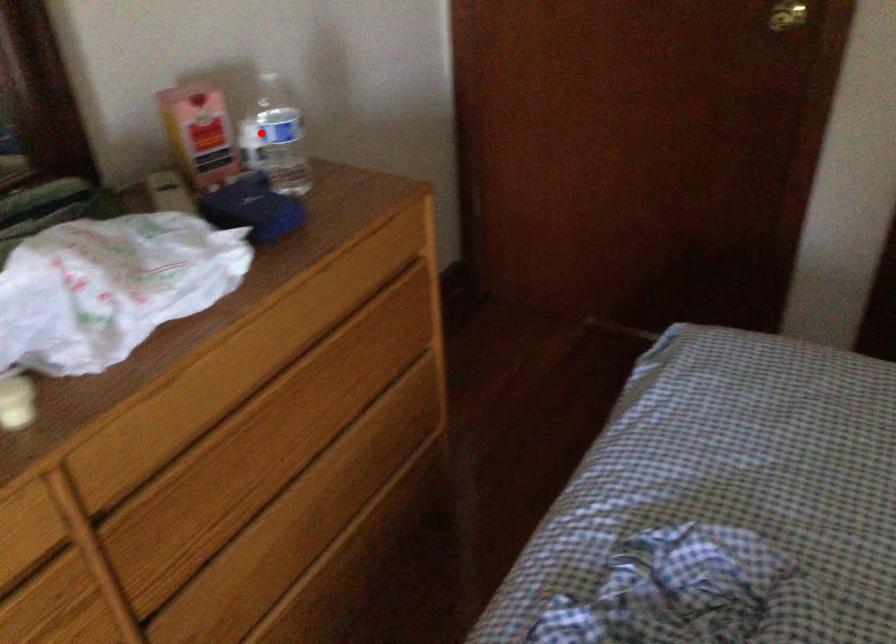
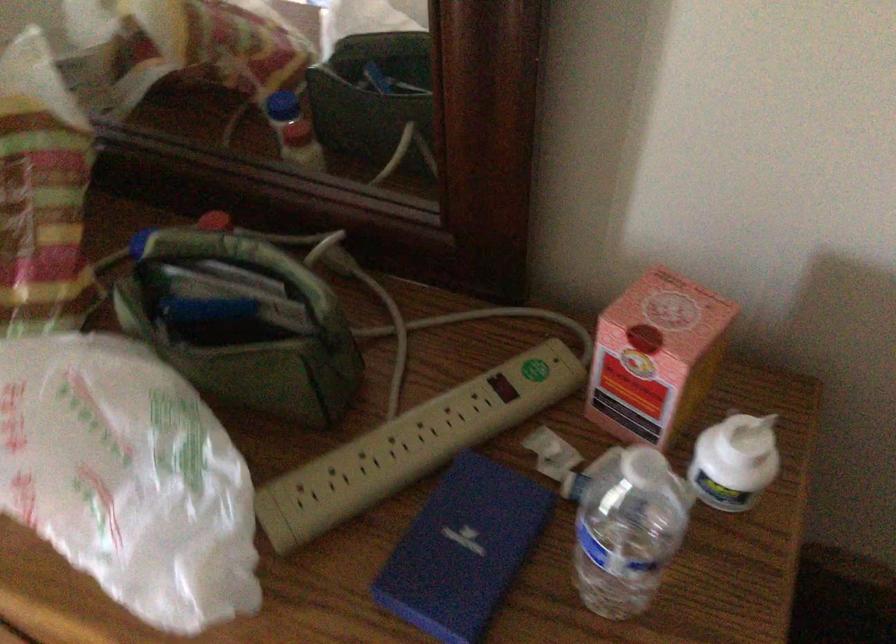
Locate, in the second image, the point that corresponds to the highlighted location in the first image.

(735, 462)